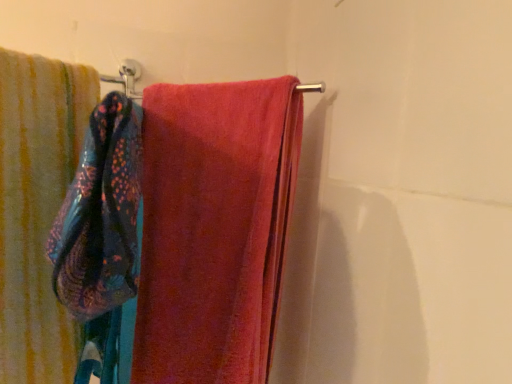
Measure the distance between point (51, 120) and camera.

Point (51, 120) is 25.08 inches from camera.

Describe the element at coordinates (214, 228) in the screenshot. I see `soft pink towel at center, which is counted as the 2th towel, starting from the left` at that location.

Identify the location of blue textured towel at left. click(x=101, y=215).

From the picture: Is blue textured towel at left inside the boundaries of soft pink towel at center, which is counted as the 2th towel, starting from the left, or outside?

The correct answer is: outside.

At what (x,y) coordinates should I click in order to perform the action: click on towel that is the 1st object directly below the blue textured towel at left (from a real-world perspective). Please return your answer as a coordinate pair (x, y). Looking at the image, I should click on (x=214, y=228).

Does point (52, 247) come in front of point (222, 288)?

Yes, point (52, 247) is closer to viewer.

From the image's perspective, which is above, blue textured towel at left or soft pink towel at center, which is counted as the 2th towel, starting from the left?

blue textured towel at left is shown above in the image.

Looking at this image, is soft pink towel at center, which is counted as the 2th towel, starting from the left, oriented towards blue textured towel at left?

No, soft pink towel at center, which is counted as the 2th towel, starting from the left, is not aimed at blue textured towel at left.

Between soft pink towel at center, which is counted as the 2th towel, starting from the left, and blue textured towel at left, which one appears on the right side from the viewer's perspective?

soft pink towel at center, which is counted as the 2th towel, starting from the left, is more to the right.

Which object is thinner, soft pink towel at center, which appears as the 1th towel when viewed from the right, or blue textured towel at left?

With smaller width is blue textured towel at left.

How much distance is there between soft pink towel at center, which appears as the 1th towel when viewed from the right, and soft cotton towel at left, which is the first towel from left to right?

They are 7.97 inches apart.

Could you tell me if soft pink towel at center, which appears as the 1th towel when viewed from the right, is facing soft cotton towel at left, the 2th towel from the right?

Yes, soft pink towel at center, which appears as the 1th towel when viewed from the right, is facing soft cotton towel at left, the 2th towel from the right.

From a real-world perspective, is soft pink towel at center, which is counted as the 2th towel, starting from the left, located beneath soft cotton towel at left, which is the first towel from left to right?

No, from a real-world perspective, soft pink towel at center, which is counted as the 2th towel, starting from the left, is not below soft cotton towel at left, which is the first towel from left to right.

How different are the orientations of soft pink towel at center, which appears as the 1th towel when viewed from the right, and soft cotton towel at left, the 2th towel from the right, in degrees?

They differ by 138 degrees in their facing directions.

Which object is wider, soft cotton towel at left, which is the first towel from left to right, or soft pink towel at center, which is counted as the 2th towel, starting from the left?

With larger width is soft cotton towel at left, which is the first towel from left to right.

Is soft cotton towel at left, the 2th towel from the right, positioned before soft pink towel at center, which is counted as the 2th towel, starting from the left?

That is True.

Is soft cotton towel at left, which is the first towel from left to right, oriented towards soft pink towel at center, which is counted as the 2th towel, starting from the left?

No, soft cotton towel at left, which is the first towel from left to right, is not oriented towards soft pink towel at center, which is counted as the 2th towel, starting from the left.

How different are the orientations of soft cotton towel at left, the 2th towel from the right, and soft pink towel at center, which appears as the 1th towel when viewed from the right, in degrees?

They differ by 138 degrees in their facing directions.

Is soft cotton towel at left, which is the first towel from left to right, taller than blue textured towel at left?

Yes.

From a real-world perspective, is soft cotton towel at left, which is the first towel from left to right, on top of blue textured towel at left?

No, from a real-world perspective, soft cotton towel at left, which is the first towel from left to right, is not above blue textured towel at left.

How many degrees apart are the facing directions of soft cotton towel at left, the 2th towel from the right, and blue textured towel at left?

The angular difference between soft cotton towel at left, the 2th towel from the right, and blue textured towel at left is 12.1 degrees.

How far apart are soft cotton towel at left, which is the first towel from left to right, and blue textured towel at left?

soft cotton towel at left, which is the first towel from left to right, is 17.59 centimeters from blue textured towel at left.

This screenshot has width=512, height=384. I want to click on towel that appears on the left of blue textured towel at left, so pos(37,209).

Are blue textured towel at left and soft cotton towel at left, which is the first towel from left to right, beside each other?

They are not placed beside each other.

In terms of size, does blue textured towel at left appear bigger or smaller than soft cotton towel at left, the 2th towel from the right?

In the image, blue textured towel at left appears to be smaller than soft cotton towel at left, the 2th towel from the right.

Is point (117, 191) positioned in front of point (51, 213)?

Yes.

The width and height of the screenshot is (512, 384). What are the coordinates of `beach towel on the left side of soft pink towel at center, which appears as the 1th towel when viewed from the right` in the screenshot? It's located at (101, 215).

Find the location of a particular element. Image resolution: width=512 pixels, height=384 pixels. the 1st towel positioned below the blue textured towel at left (from the image's perspective) is located at coordinates (214, 228).

Which object lies further to the anchor point soft cotton towel at left, the 2th towel from the right, soft pink towel at center, which is counted as the 2th towel, starting from the left, or blue textured towel at left?

soft pink towel at center, which is counted as the 2th towel, starting from the left, is positioned further to the anchor soft cotton towel at left, the 2th towel from the right.

From the image, which object appears to be nearer to soft pink towel at center, which appears as the 1th towel when viewed from the right, soft cotton towel at left, the 2th towel from the right, or blue textured towel at left?

The object closer to soft pink towel at center, which appears as the 1th towel when viewed from the right, is soft cotton towel at left, the 2th towel from the right.

Considering their positions, is blue textured towel at left positioned closer to soft cotton towel at left, which is the first towel from left to right, than soft pink towel at center, which is counted as the 2th towel, starting from the left?

Among the two, blue textured towel at left is located nearer to soft cotton towel at left, which is the first towel from left to right.

Estimate the real-world distances between objects in this image. Which object is closer to blue textured towel at left, soft pink towel at center, which appears as the 1th towel when viewed from the right, or soft cotton towel at left, which is the first towel from left to right?

Based on the image, soft cotton towel at left, which is the first towel from left to right, appears to be nearer to blue textured towel at left.

Considering their positions, is blue textured towel at left positioned closer to soft pink towel at center, which appears as the 1th towel when viewed from the right, than soft cotton towel at left, the 2th towel from the right?

soft cotton towel at left, the 2th towel from the right, is positioned closer to the anchor soft pink towel at center, which appears as the 1th towel when viewed from the right.

Based on their spatial positions, is soft cotton towel at left, the 2th towel from the right, or soft pink towel at center, which is counted as the 2th towel, starting from the left, closer to blue textured towel at left?

soft cotton towel at left, the 2th towel from the right.

Find the location of a particular element. This screenshot has height=384, width=512. beach towel between soft cotton towel at left, the 2th towel from the right, and soft pink towel at center, which is counted as the 2th towel, starting from the left, in the horizontal direction is located at coordinates (101, 215).